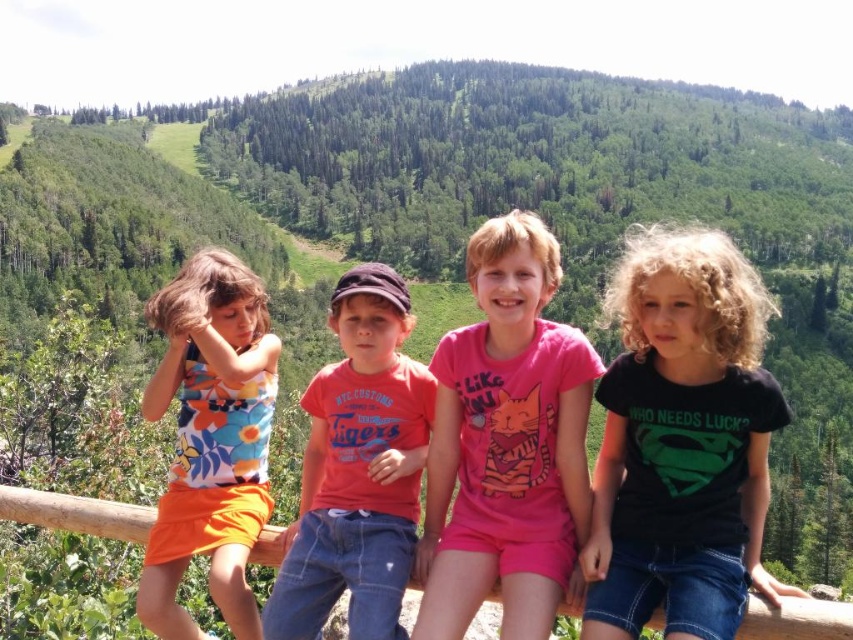
Question: Which object appears closest to the camera in this image?

Choices:
 (A) black cotton shirt at center
 (B) matte orange t-shirt at center
 (C) pink cotton shirt at center

Answer: (A)

Question: Which object is positioned farthest from the floral fabric dress at left?

Choices:
 (A) pink cotton shirt at center
 (B) black cotton shirt at center
 (C) matte orange t-shirt at center

Answer: (B)

Question: In this image, where is pink cotton shirt at center located relative to floral fabric dress at left?

Choices:
 (A) left
 (B) right

Answer: (B)

Question: Among these points, which one is nearest to the camera?

Choices:
 (A) (308, 636)
 (B) (573, 504)
 (C) (215, 330)

Answer: (A)

Question: Is black cotton shirt at center behind floral fabric dress at left?

Choices:
 (A) no
 (B) yes

Answer: (A)

Question: Is matte orange t-shirt at center smaller than floral fabric dress at left?

Choices:
 (A) no
 (B) yes

Answer: (B)